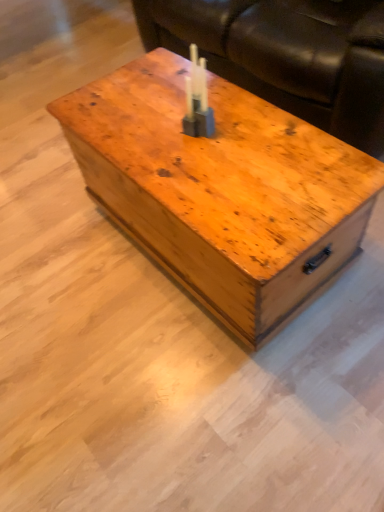
Find the location of a particular element. The image size is (384, 512). free space to the left of translucent plastic candle at center is located at coordinates (147, 141).